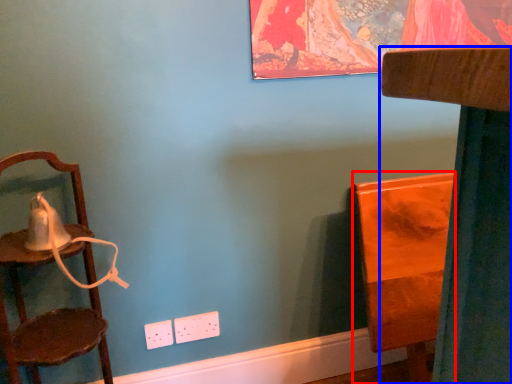
Question: Which point is further to the camera, furniture (highlighted by a red box) or furniture (highlighted by a blue box)?

Choices:
 (A) furniture
 (B) furniture

Answer: (A)